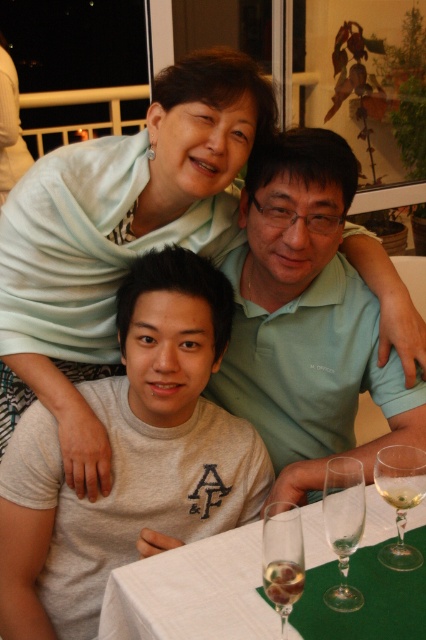
Is point (337, 161) positioned in front of point (287, 576)?

No, it is behind (287, 576).

Between point (359, 349) and point (279, 582), which one is positioned behind?

The point (359, 349) is more distant.

Find the location of a particular element. This screenshot has height=640, width=426. green matte shirt at center is located at coordinates (305, 317).

Can you confirm if clear glass wine glass at lower center is bigger than transparent glass at table center?

Yes.

In the scene shown: Does clear glass wine glass at lower center appear on the left side of transparent glass at table center?

Correct, you'll find clear glass wine glass at lower center to the left of transparent glass at table center.

Is point (287, 561) more distant than point (337, 548)?

No, it is not.

This screenshot has height=640, width=426. I want to click on clear glass wine glass at lower center, so click(x=282, y=557).

Between clear glass wine at center and clear glass wine at lower right, which one is positioned higher?

clear glass wine at lower right

Which is more to the right, clear glass wine at center or clear glass wine at lower right?

clear glass wine at lower right is more to the right.

Between point (270, 595) and point (389, 477), which one is positioned in front?

Point (270, 595) is more forward.

Where is `clear glass wine at center`? clear glass wine at center is located at coordinates (282, 582).